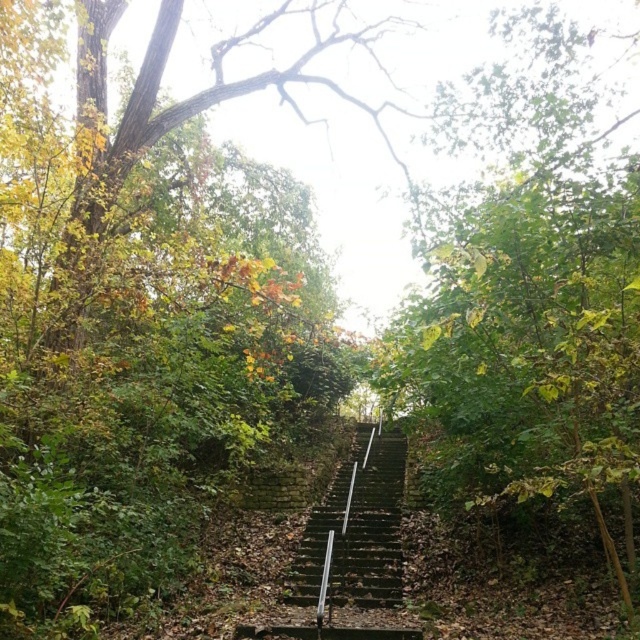
You are a hiker trying to navigate the path between the green leafy tree at center and the dark green stone stairs at center. Which object is taller and could potentially block your view ahead?

The green leafy tree at center is much taller than the dark green stone stairs at center, so it could potentially block your view ahead.

A hiker is standing at the bottom of the stone stairs and wants to reach the green leafy tree at center. Given that the hiker can climb stairs at a rate of 1 meter per second, how long will it take them to reach the tree?

The green leafy tree at center is 14.91 meters away from the hiker at the bottom of the stairs. Since the hiker climbs at 1 meter per second, it will take them approximately 14.91 seconds to reach the tree.

In the scene shown: You are a hiker carrying a backpack and need to navigate the path ahead. You notice the green leafy tree at center and the dark green stone stairs at center. Which object is larger in size?

The dark green stone stairs at center are larger in size than the green leafy tree at center according to the description.